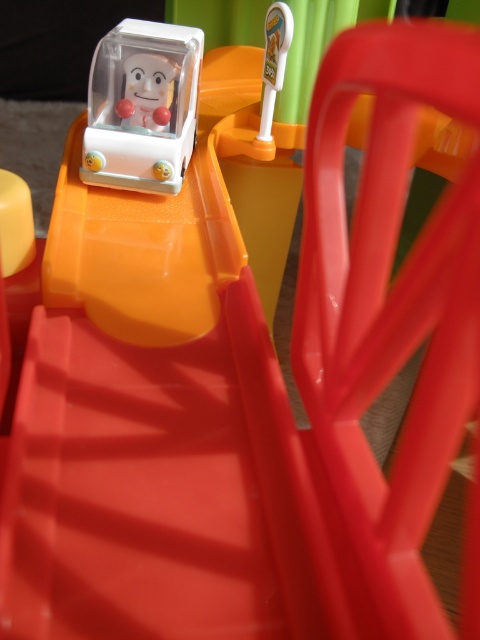
Question: From the image, what is the correct spatial relationship of matte white toy car at upper left in relation to matte plastic doll at upper center?

Choices:
 (A) below
 (B) above

Answer: (A)

Question: Can you confirm if matte white toy car at upper left is thinner than matte plastic doll at upper center?

Choices:
 (A) yes
 (B) no

Answer: (B)

Question: Is matte white toy car at upper left smaller than matte plastic doll at upper center?

Choices:
 (A) no
 (B) yes

Answer: (A)

Question: Which object is farther from the camera taking this photo?

Choices:
 (A) matte white toy car at upper left
 (B) matte plastic doll at upper center

Answer: (B)